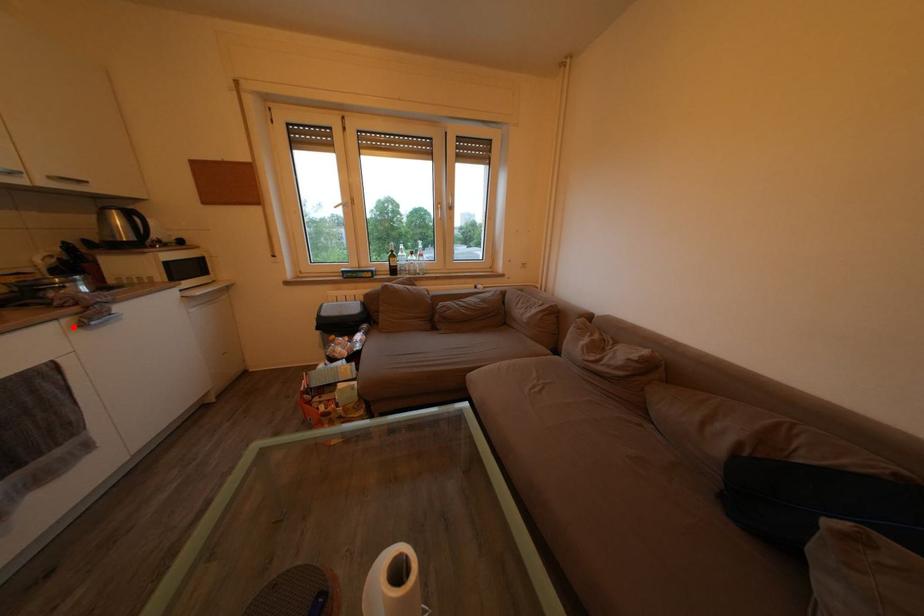
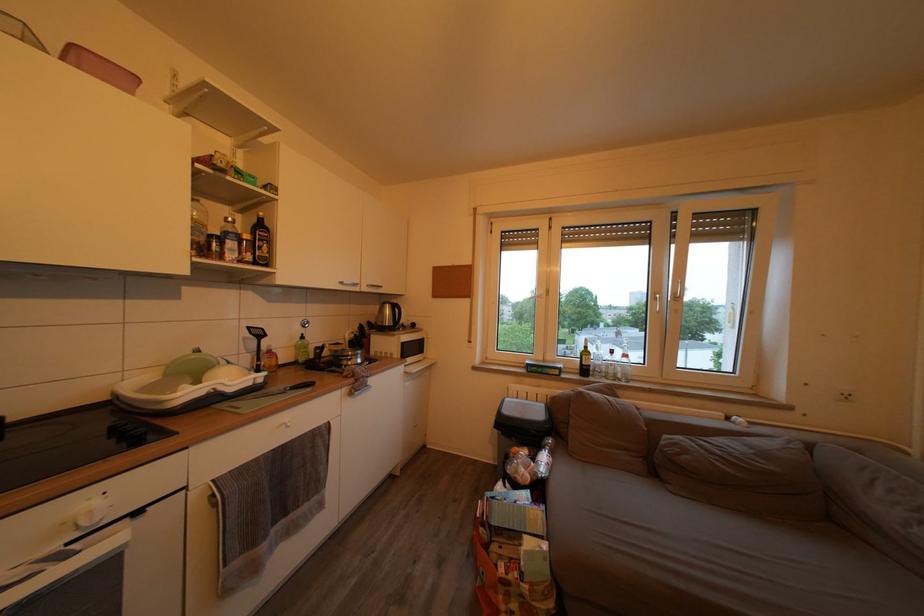
The point at the highlighted location is marked in the first image. Where is the corresponding point in the second image?

(351, 395)